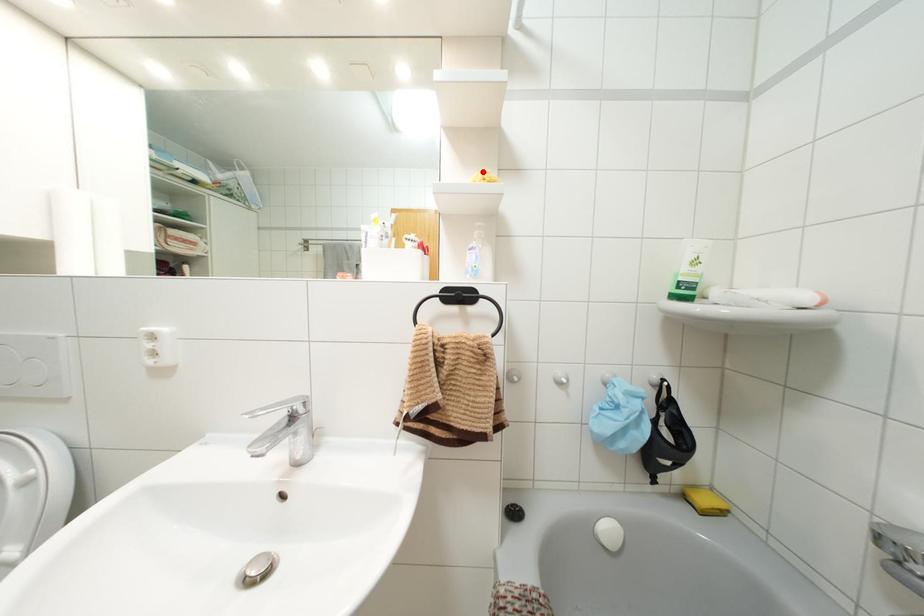
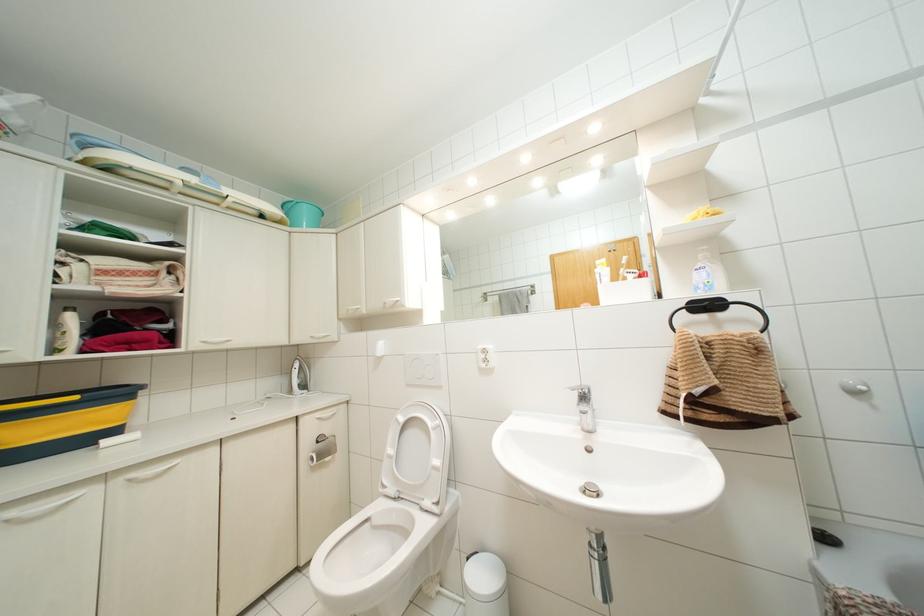
Where in the second image is the point corresponding to the highlighted location from the first image?

(701, 208)